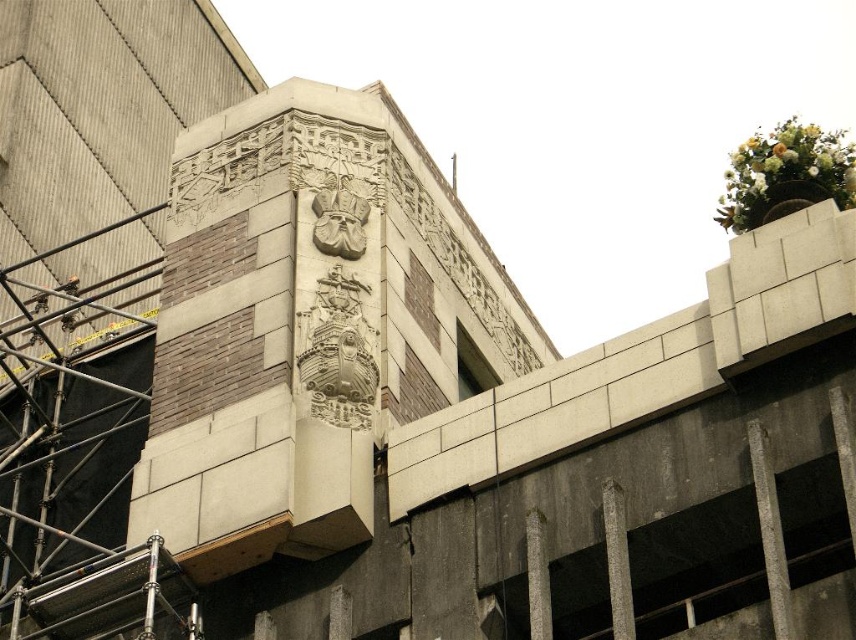
You are an architect examining this building. You notice a point at coordinates (785, 173). What object is located at this point?

The point at coordinates (785, 173) corresponds to the white floral bouquet at upper right.

You are standing in front of the building and want to reach the point marked at coordinates (617, 570). The safety regulations state that you must stay within 30 meters of the camera position. Can you safely reach that point without violating the safety rules?

The point at (617, 570) is 35.75 meters away from the camera, which exceeds the 30 meters safety limit. Therefore, you cannot safely reach that point without violating the safety rules.

You are a window cleaner standing on the ledge on the right side of the building. You need to clean the smooth concrete pillar at center. However, there is a white floral bouquet at upper right nearby. Can you safely reach the pillar without disturbing the bouquet?

The white floral bouquet at upper right might be wider than the smooth concrete pillar at center, so there is a possibility that reaching the pillar could disturb the bouquet. It would be safer to check the exact dimensions before proceeding.